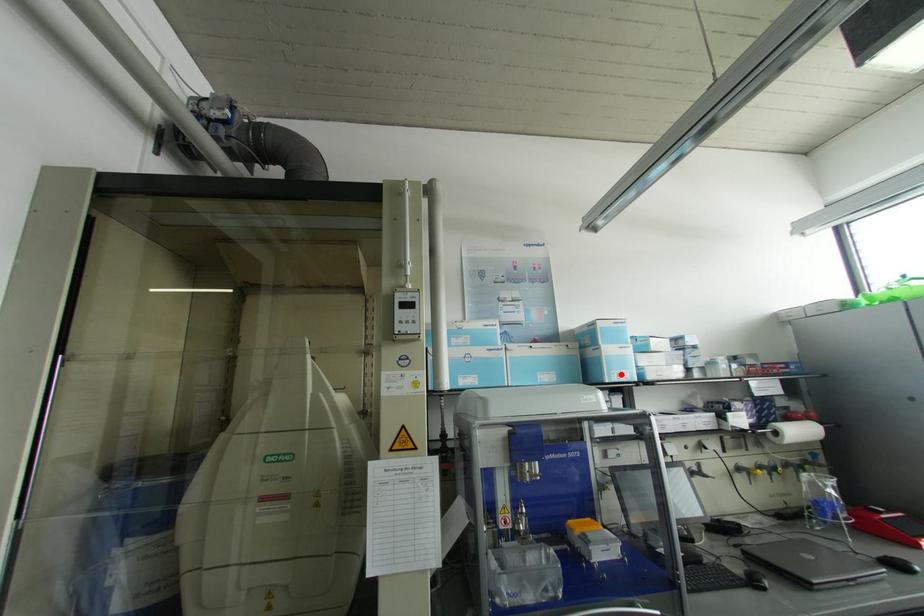
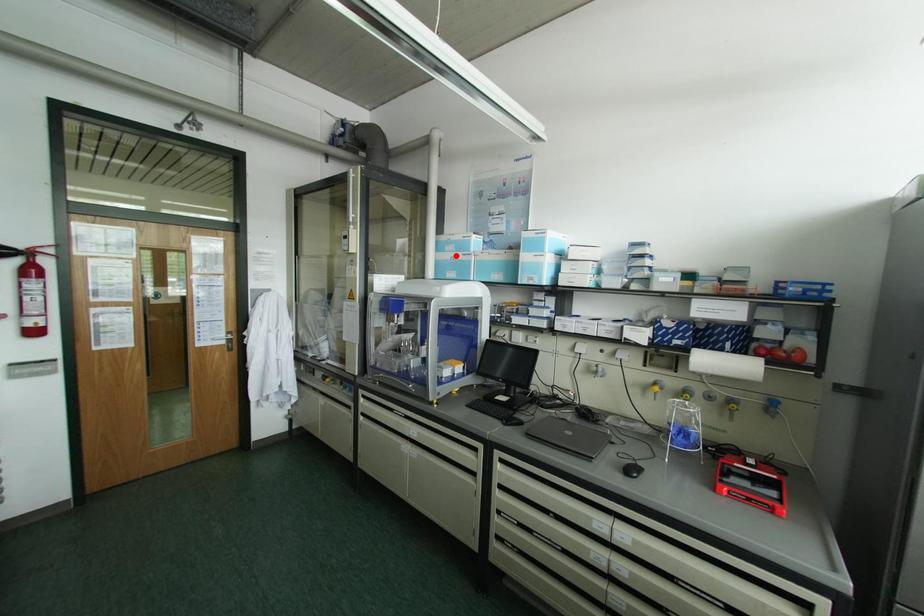
From the picture: I am providing you with two images of the same scene from different viewpoints. A red point is marked on the first image and another point is marked on the second image. Are the points marked in image1 and image2 representing the same 3D position?

No